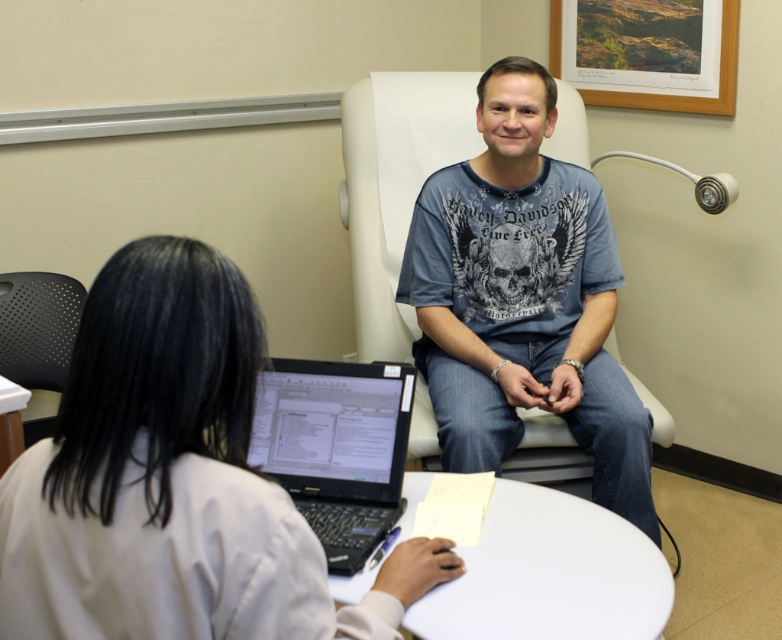
Is white smooth table at center thinner than black perforated chair at left?

No, white smooth table at center is not thinner than black perforated chair at left.

Is white smooth table at center taller than black perforated chair at left?

Incorrect, white smooth table at center's height is not larger of black perforated chair at left's.

Identify the location of white smooth table at center. This screenshot has height=640, width=782. (549, 573).

Which of these two, white lab coat at center or white smooth table at center, stands shorter?

white smooth table at center is shorter.

Where is `white lab coat at center`? The image size is (782, 640). white lab coat at center is located at coordinates (174, 480).

The image size is (782, 640). What are the coordinates of `white lab coat at center` in the screenshot? It's located at 174,480.

Is blue cotton t-shirt at center behind white smooth table at center?

Yes, it is.

Does blue cotton t-shirt at center appear on the right side of white smooth table at center?

Yes, blue cotton t-shirt at center is to the right of white smooth table at center.

Does point (418, 220) come behind point (488, 602)?

Yes, it is behind point (488, 602).

Where is `blue cotton t-shirt at center`? blue cotton t-shirt at center is located at coordinates (522, 298).